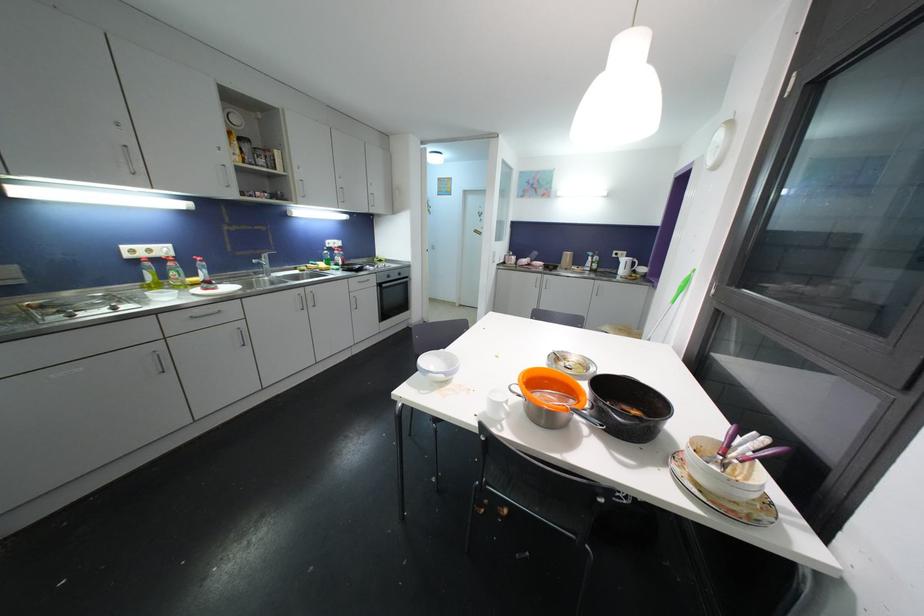
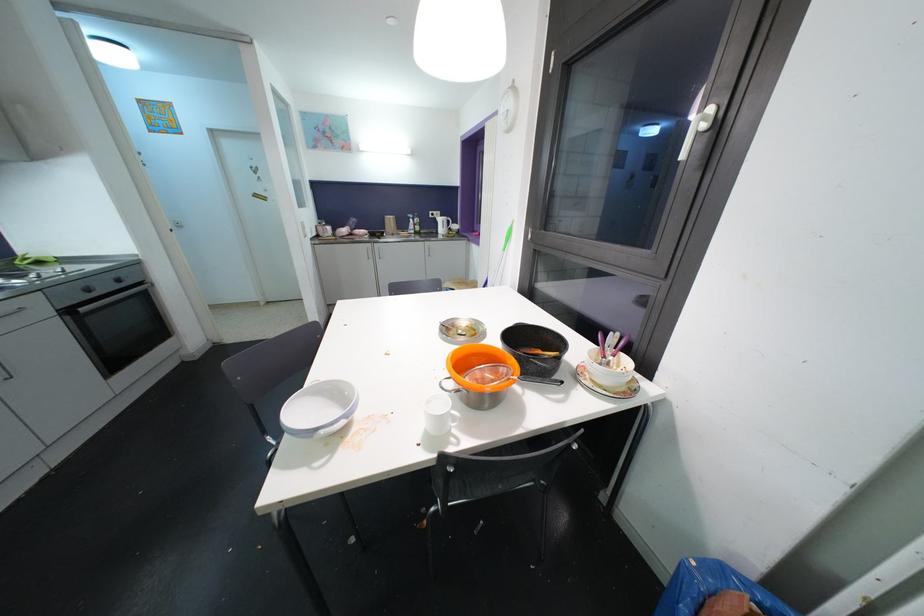
Locate, in the second image, the point that corresponds to point 433,378 in the first image.

(323, 435)